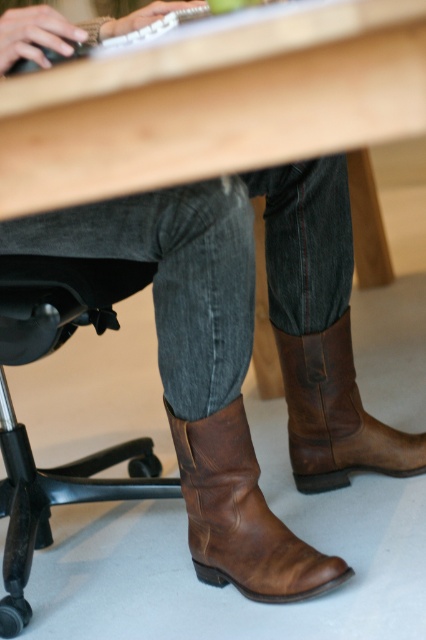
Question: Which point is farther to the camera?

Choices:
 (A) brown leather cowboy boot at lower center
 (B) brown leather cowboy boot at lower right

Answer: (B)

Question: Which point is farther to the camera?

Choices:
 (A) (350, 417)
 (B) (187, 499)

Answer: (A)

Question: Is brown leather cowboy boot at lower center bigger than brown leather cowboy boot at lower right?

Choices:
 (A) no
 (B) yes

Answer: (B)

Question: Does brown leather cowboy boot at lower center come in front of brown leather cowboy boot at lower right?

Choices:
 (A) no
 (B) yes

Answer: (B)

Question: Is brown leather cowboy boot at lower center to the left of brown leather cowboy boot at lower right from the viewer's perspective?

Choices:
 (A) no
 (B) yes

Answer: (B)